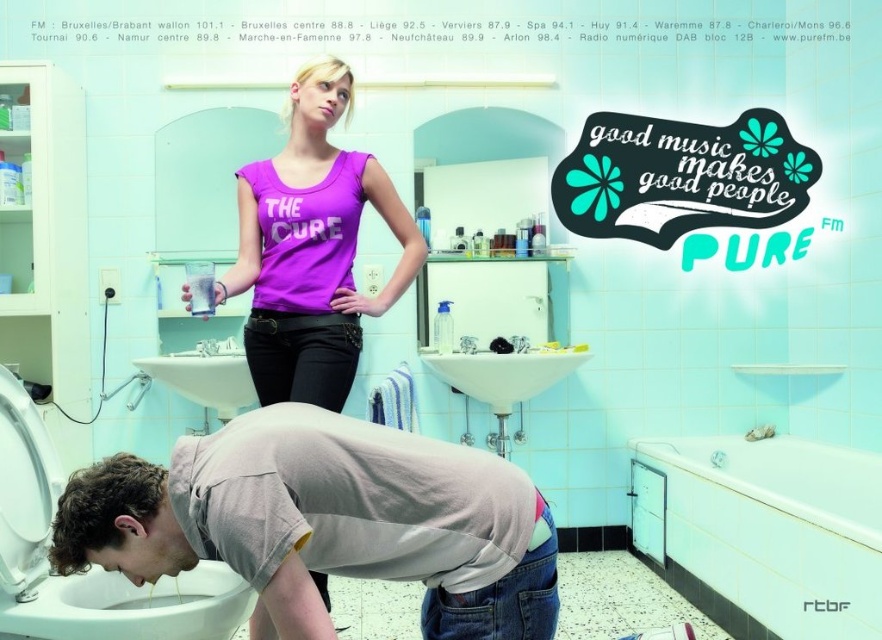
Can you confirm if gray cotton shirt at lower center is bigger than white ceramic sink at center?

Yes.

Describe the element at coordinates (324, 520) in the screenshot. This screenshot has height=640, width=882. I see `gray cotton shirt at lower center` at that location.

Describe the element at coordinates (324, 520) in the screenshot. I see `gray cotton shirt at lower center` at that location.

Where is `gray cotton shirt at lower center`? This screenshot has height=640, width=882. gray cotton shirt at lower center is located at coordinates (324, 520).

Does purple matte tank top at upper center lie behind white glossy toilet bowl at lower left?

Yes, purple matte tank top at upper center is further from the viewer.

Does purple matte tank top at upper center have a larger size compared to white glossy toilet bowl at lower left?

Yes.

Measure the distance between point (x=344, y=195) and camera.

A distance of 2.27 meters exists between point (x=344, y=195) and camera.

The width and height of the screenshot is (882, 640). Find the location of `purple matte tank top at upper center`. purple matte tank top at upper center is located at coordinates (311, 248).

Is gray cotton shirt at lower center thinner than white glossy toilet bowl at lower left?

No.

Is point (241, 435) behind point (219, 620)?

No, (241, 435) is in front of (219, 620).

This screenshot has width=882, height=640. What do you see at coordinates (324, 520) in the screenshot?
I see `gray cotton shirt at lower center` at bounding box center [324, 520].

What are the coordinates of `gray cotton shirt at lower center` in the screenshot? It's located at (324, 520).